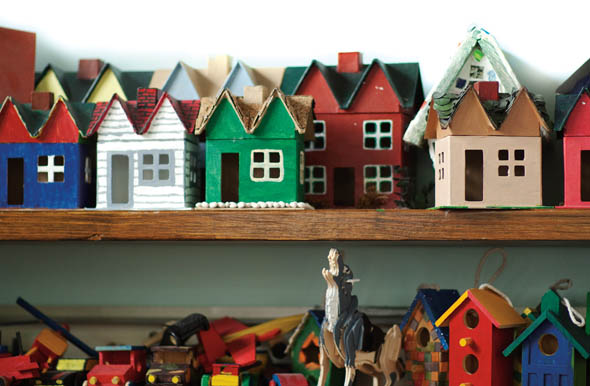
Locate an element on the screen. white wall is located at coordinates (434, 46), (113, 43).